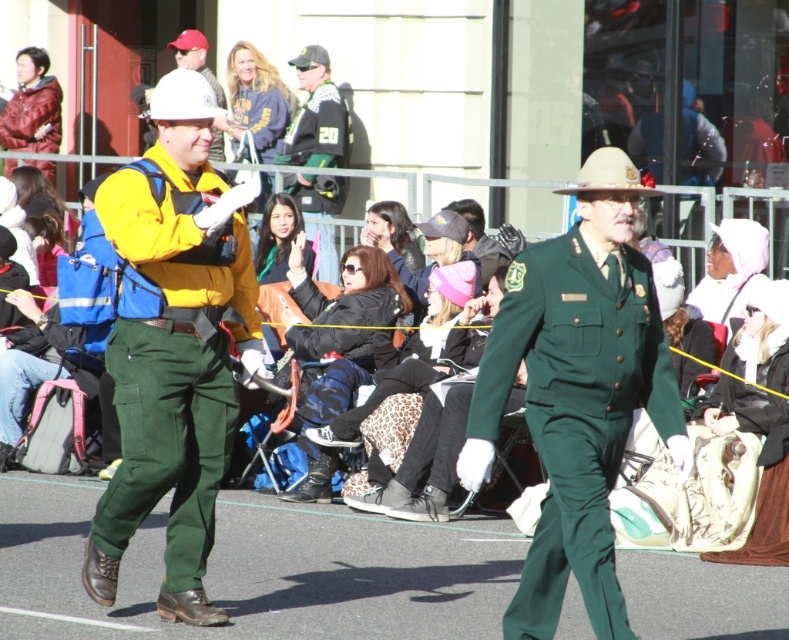
You are a photographer at the event and want to capture a photo that includes both the green cotton pants at left and the white matte hard hat at upper center. Which object should you focus on first to ensure both are in the frame?

The green cotton pants at left is located below the white matte hard hat at upper center, so you should focus on the white matte hard hat at upper center first to ensure both are in the frame.